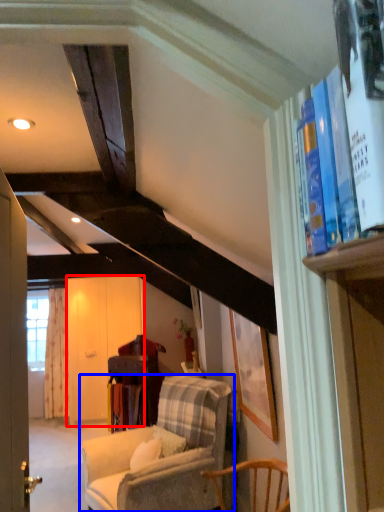
Question: Which of the following is the closest to the observer, screen door (highlighted by a red box) or chair (highlighted by a blue box)?

Choices:
 (A) screen door
 (B) chair

Answer: (B)